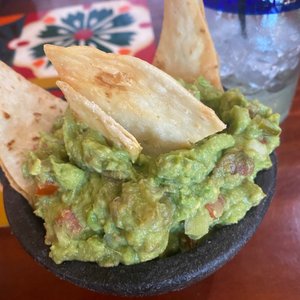
Find the location of a particular element. The width and height of the screenshot is (300, 300). table is located at coordinates (263, 265).